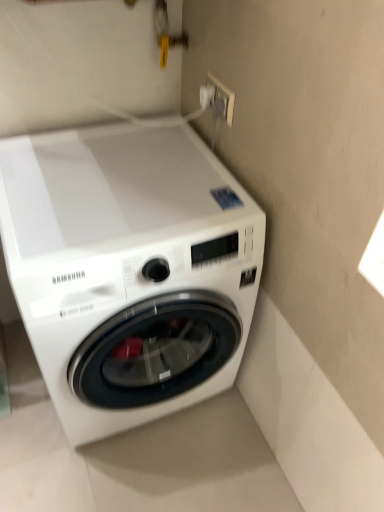
You are a GUI agent. You are given a task and a screenshot of the screen. Output one action in this format:
    pyautogui.click(x=<x>, y=<y>)
    Task: Click on the white glossy washing machine at lower left
    
    Given the screenshot: What is the action you would take?
    pyautogui.click(x=128, y=270)

This screenshot has width=384, height=512. What do you see at coordinates (128, 270) in the screenshot? I see `white glossy washing machine at lower left` at bounding box center [128, 270].

What is the approximate width of white plastic socket at upper right?

The width of white plastic socket at upper right is 0.62 inches.

What are the coordinates of `white plastic socket at upper right` in the screenshot? It's located at (221, 100).

The image size is (384, 512). Describe the element at coordinates (221, 100) in the screenshot. I see `white plastic socket at upper right` at that location.

Identify the location of white glossy washing machine at lower left. Image resolution: width=384 pixels, height=512 pixels. (128, 270).

Is white glossy washing machine at lower left to the right of white plastic socket at upper right from the viewer's perspective?

In fact, white glossy washing machine at lower left is to the left of white plastic socket at upper right.

Between white glossy washing machine at lower left and white plastic socket at upper right, which one is positioned behind?

white plastic socket at upper right is behind.

Is point (204, 315) behind point (213, 110)?

No.

From the image's perspective, between white glossy washing machine at lower left and white plastic socket at upper right, which one is located above?

white plastic socket at upper right is shown above in the image.

From a real-world perspective, is white glossy washing machine at lower left on top of white plastic socket at upper right?

No, from a real-world perspective, white glossy washing machine at lower left is not on top of white plastic socket at upper right.

Considering the sizes of objects white glossy washing machine at lower left and white plastic socket at upper right in the image provided, who is wider, white glossy washing machine at lower left or white plastic socket at upper right?

Wider between the two is white glossy washing machine at lower left.

Considering the sizes of white glossy washing machine at lower left and white plastic socket at upper right in the image, is white glossy washing machine at lower left taller or shorter than white plastic socket at upper right?

Considering their sizes, white glossy washing machine at lower left has more height than white plastic socket at upper right.

Considering the relative sizes of white glossy washing machine at lower left and white plastic socket at upper right in the image provided, is white glossy washing machine at lower left bigger than white plastic socket at upper right?

Yes.

Is white plastic socket at upper right surrounded by white glossy washing machine at lower left?

No, white plastic socket at upper right is not surrounded by white glossy washing machine at lower left.

Is white glossy washing machine at lower left not near white plastic socket at upper right?

They are positioned close to each other.

Is white glossy washing machine at lower left oriented towards white plastic socket at upper right?

No, white glossy washing machine at lower left is not aimed at white plastic socket at upper right.

From the picture: How many degrees apart are the facing directions of white glossy washing machine at lower left and white plastic socket at upper right?

There is a 89.5-degree angle between the facing directions of white glossy washing machine at lower left and white plastic socket at upper right.

Identify the location of electric outlet above the white glossy washing machine at lower left (from the image's perspective). The height and width of the screenshot is (512, 384). (221, 100).

Between white plastic socket at upper right and white glossy washing machine at lower left, which one appears on the left side from the viewer's perspective?

white glossy washing machine at lower left is more to the left.

Which object is further away from the camera, white plastic socket at upper right or white glossy washing machine at lower left?

Positioned behind is white plastic socket at upper right.

Is point (216, 93) more distant than point (170, 387)?

That is False.

From the picture: From the image's perspective, is white plastic socket at upper right above white glossy washing machine at lower left?

Yes.

From a real-world perspective, is white plastic socket at upper right positioned above or below white glossy washing machine at lower left?

From a real-world perspective, white plastic socket at upper right is physically above white glossy washing machine at lower left.

Considering the relative sizes of white plastic socket at upper right and white glossy washing machine at lower left in the image provided, is white plastic socket at upper right wider than white glossy washing machine at lower left?

No, white plastic socket at upper right is not wider than white glossy washing machine at lower left.

In terms of height, does white plastic socket at upper right look taller or shorter compared to white glossy washing machine at lower left?

Considering their sizes, white plastic socket at upper right has less height than white glossy washing machine at lower left.

Between white plastic socket at upper right and white glossy washing machine at lower left, which one has larger size?

With larger size is white glossy washing machine at lower left.

Consider the image. Which is correct: white plastic socket at upper right is inside white glossy washing machine at lower left, or outside of it?

white plastic socket at upper right is located beyond the bounds of white glossy washing machine at lower left.

Looking at this image, is white plastic socket at upper right touching white glossy washing machine at lower left?

No.

Could you tell me if white plastic socket at upper right is facing white glossy washing machine at lower left?

No, white plastic socket at upper right is not oriented towards white glossy washing machine at lower left.

Can you tell me how much white plastic socket at upper right and white glossy washing machine at lower left differ in facing direction?

The facing directions of white plastic socket at upper right and white glossy washing machine at lower left are 89.5 degrees apart.

How far apart are white plastic socket at upper right and white glossy washing machine at lower left?

white plastic socket at upper right is 20.35 inches from white glossy washing machine at lower left.

At what (x,y) coordinates should I click in order to perform the action: click on electric outlet above the white glossy washing machine at lower left (from a real-world perspective). Please return your answer as a coordinate pair (x, y). The image size is (384, 512). Looking at the image, I should click on (221, 100).

The image size is (384, 512). What are the coordinates of `washing machine on the left of white plastic socket at upper right` in the screenshot? It's located at (128, 270).

This screenshot has height=512, width=384. Identify the location of electric outlet behind the white glossy washing machine at lower left. (221, 100).